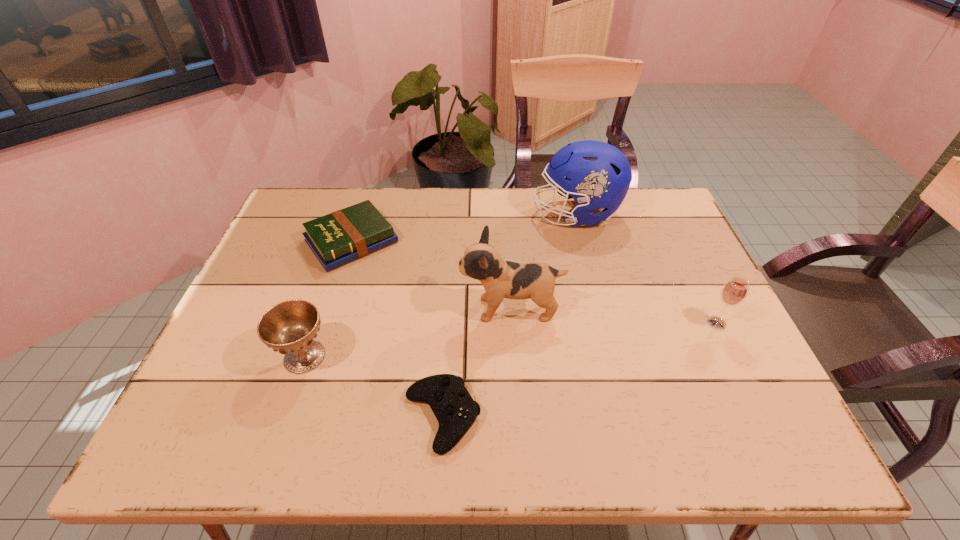
In order to click on chalice that is at the left edge in this screenshot , I will do `click(290, 327)`.

Image resolution: width=960 pixels, height=540 pixels. What are the coordinates of `book located at the left edge` in the screenshot? It's located at point(345,235).

Find the location of a particular element. object that is at the right edge is located at coordinates (734, 292).

Locate an element on the screen. This screenshot has height=540, width=960. object present at the far left corner is located at coordinates click(345, 235).

Where is `vacant area at the far edge`? The width and height of the screenshot is (960, 540). vacant area at the far edge is located at coordinates (525, 224).

In the image, there is a desktop. Where is `vacant area at the near edge`? This screenshot has width=960, height=540. vacant area at the near edge is located at coordinates (660, 436).

Find the location of a particular element. This screenshot has height=540, width=960. free space at the left edge of the desktop is located at coordinates (274, 306).

Find the location of a particular element. This screenshot has height=540, width=960. vacant space at the right edge is located at coordinates (657, 260).

The height and width of the screenshot is (540, 960). Identify the location of free point at the far left corner. (290, 216).

In the image, there is a desktop. Where is `free region at the near left corner`? The image size is (960, 540). free region at the near left corner is located at coordinates (248, 419).